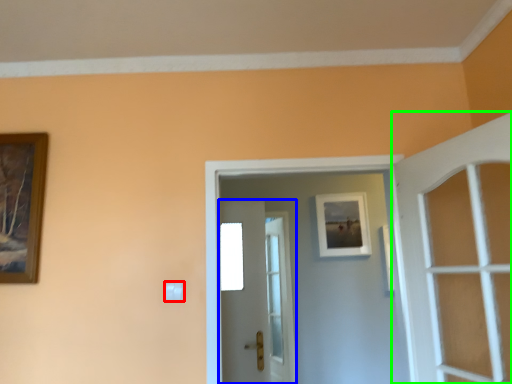
Question: Estimate the real-world distances between objects in this image. Which object is farther from light switch (highlighted by a red box), door (highlighted by a blue box) or door (highlighted by a green box)?

Choices:
 (A) door
 (B) door

Answer: (A)